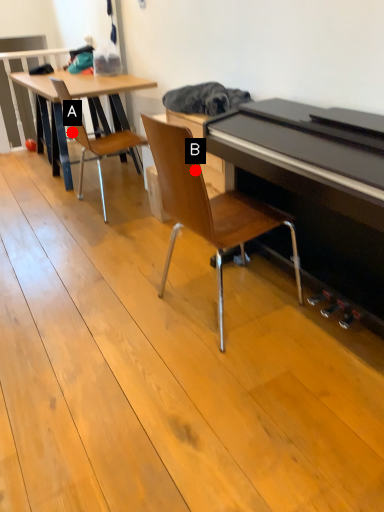
Question: Two points are circled on the image, labeled by A and B beside each circle. Which point appears farthest from the camera in this image?

Choices:
 (A) A is further
 (B) B is further

Answer: (A)